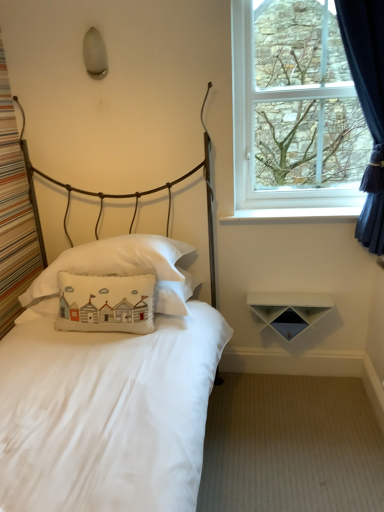
Question: From a real-world perspective, is white matte shelf at lower right physically located above or below dark blue velvet curtain at right?

Choices:
 (A) above
 (B) below

Answer: (B)

Question: Choose the correct answer: Is white matte shelf at lower right inside dark blue velvet curtain at right or outside it?

Choices:
 (A) outside
 (B) inside

Answer: (A)

Question: Estimate the real-world distances between objects in this image. Which object is closer to the white cotton pillow at center, which ranks as the 3th pillow in bottom-to-top order?

Choices:
 (A) white matte bed at left
 (B) white cotton pillow at center, the second pillow when ordered from top to bottom
 (C) clear glass window at upper right
 (D) white painted wood at upper right
 (E) white cotton pillow at center, acting as the 3th pillow starting from the top

Answer: (E)

Question: Which object is positioned closest to the white cotton pillow at center, placed as the 1th pillow when sorted from bottom to top?

Choices:
 (A) dark blue velvet curtain at right
 (B) white matte shelf at lower right
 (C) white painted wood at upper right
 (D) white cotton pillow at center, which ranks as the second pillow in bottom-to-top order
 (E) white cotton pillow at center, which ranks as the 3th pillow in bottom-to-top order

Answer: (E)